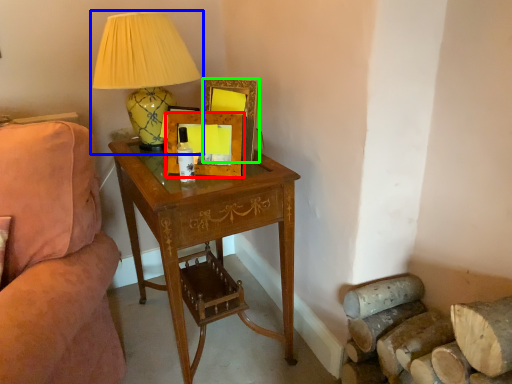
Question: Which is farther away from picture frame (highlighted by a red box)? lamp (highlighted by a blue box) or picture frame (highlighted by a green box)?

Choices:
 (A) lamp
 (B) picture frame

Answer: (A)